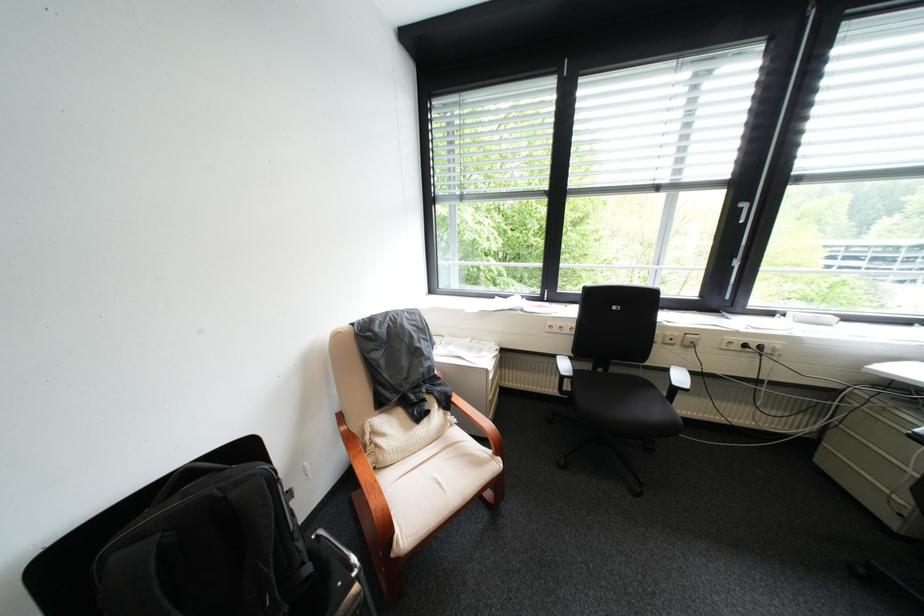
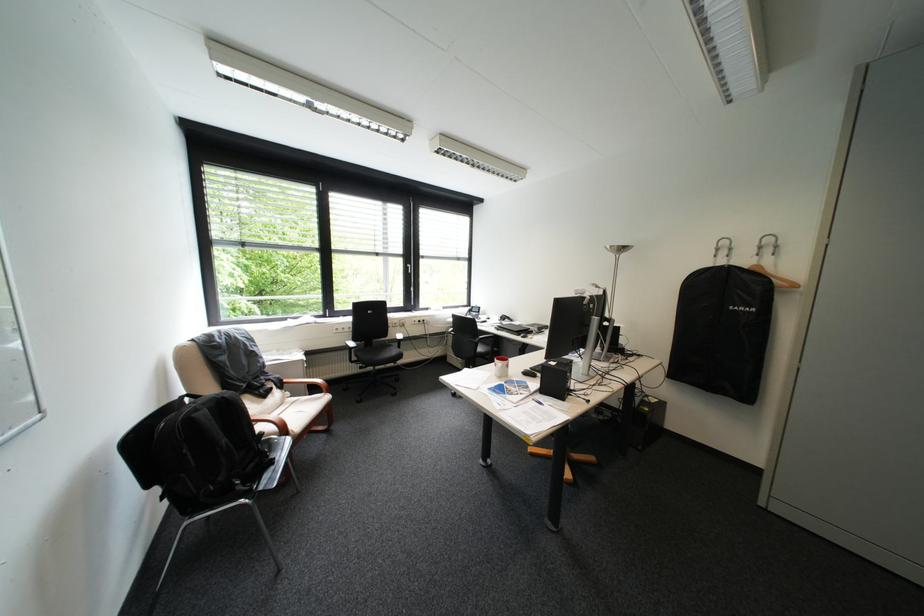
In the second image, find the point that corresponds to [419,430] in the first image.

(272, 403)